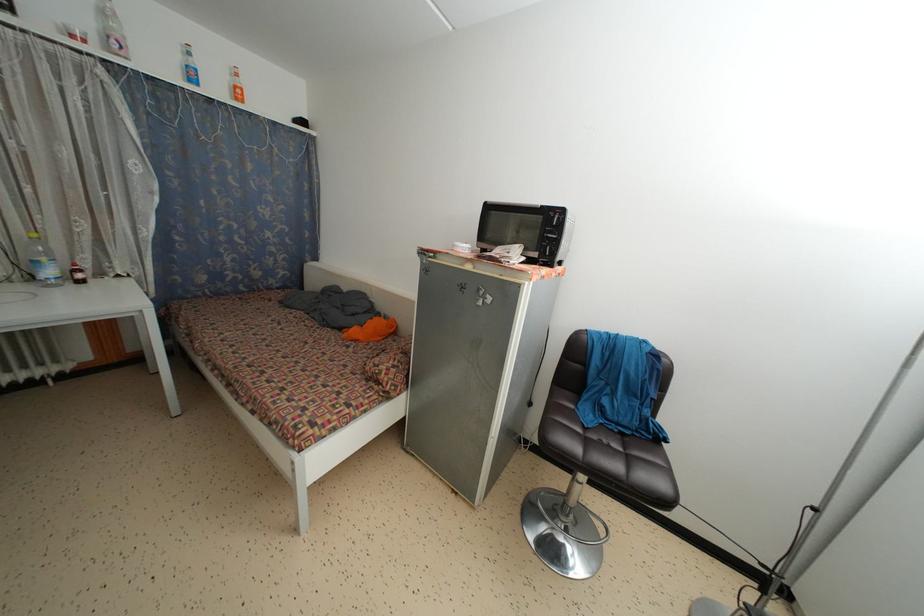
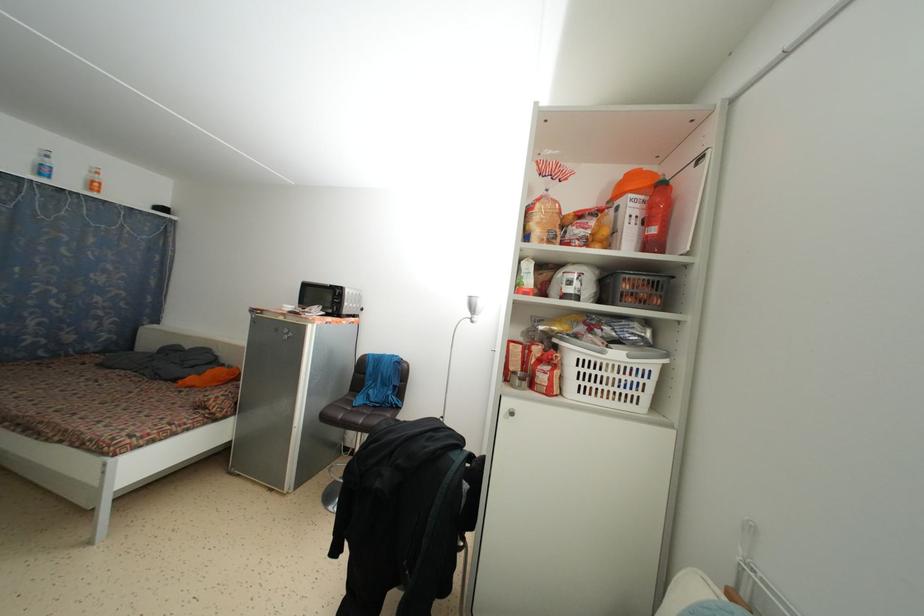
What movement of the cameraman would produce the second image?

The cameraman walked toward right, backward.